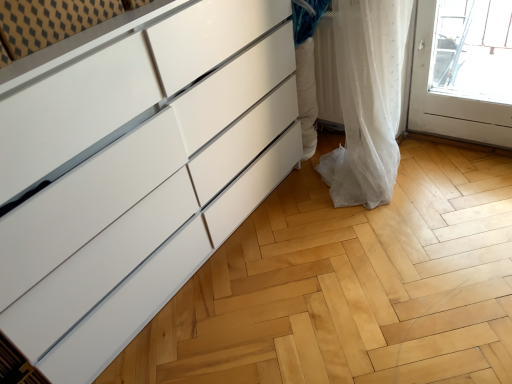
Identify the location of free spot in front of white sheer curtain at lower right. (386, 218).